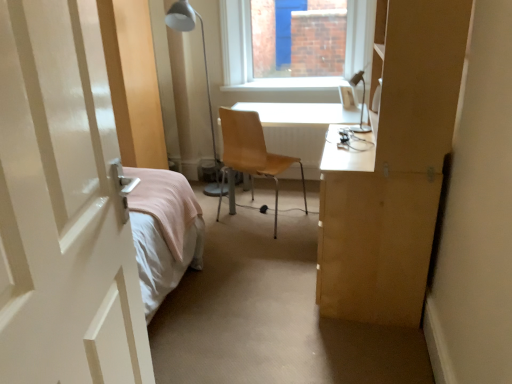
Where is `free space in front of light brown wood chair at center`? free space in front of light brown wood chair at center is located at coordinates (273, 252).